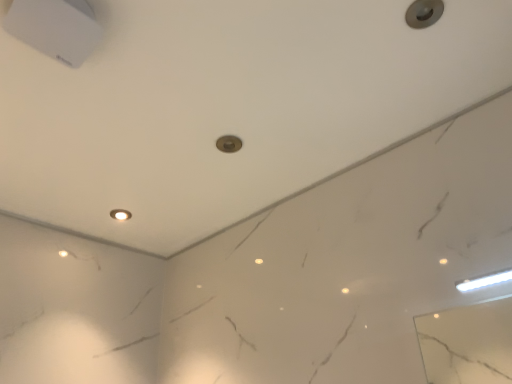
Question: In terms of width, does metallic gray knob at upper right look wider or thinner when compared to matte white light fixture at center?

Choices:
 (A) wide
 (B) thin

Answer: (B)

Question: Is point coord(422,1) positioned closer to the camera than point coord(112,213)?

Choices:
 (A) closer
 (B) farther

Answer: (A)

Question: Is metallic gray knob at upper right taller or shorter than matte white light fixture at center?

Choices:
 (A) tall
 (B) short

Answer: (B)

Question: From a real-world perspective, is matte white light fixture at center physically located above or below metallic gray knob at upper right?

Choices:
 (A) above
 (B) below

Answer: (A)

Question: In terms of height, does matte white light fixture at center look taller or shorter compared to metallic gray knob at upper right?

Choices:
 (A) tall
 (B) short

Answer: (A)

Question: Based on their sizes in the image, would you say matte white light fixture at center is bigger or smaller than metallic gray knob at upper right?

Choices:
 (A) small
 (B) big

Answer: (B)

Question: Is point (126, 218) positioned closer to the camera than point (425, 4)?

Choices:
 (A) closer
 (B) farther

Answer: (B)